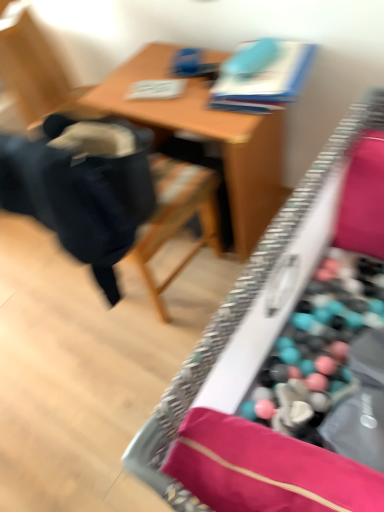
Question: Considering the relative positions of wooden desk at center and black fabric chair at left in the image provided, is wooden desk at center to the left of black fabric chair at left from the viewer's perspective?

Choices:
 (A) no
 (B) yes

Answer: (A)

Question: Would you say wooden desk at center is a long distance from black fabric chair at left?

Choices:
 (A) yes
 (B) no

Answer: (B)

Question: From a real-world perspective, does wooden desk at center stand above black fabric chair at left?

Choices:
 (A) no
 (B) yes

Answer: (A)

Question: From a real-world perspective, is wooden desk at center beneath black fabric chair at left?

Choices:
 (A) no
 (B) yes

Answer: (B)

Question: From the image's perspective, is wooden desk at center over black fabric chair at left?

Choices:
 (A) no
 (B) yes

Answer: (A)

Question: Considering the positions of black fabric chair at left and wooden table at center in the image, is black fabric chair at left taller or shorter than wooden table at center?

Choices:
 (A) tall
 (B) short

Answer: (A)

Question: Considering the positions of black fabric chair at left and wooden table at center in the image, is black fabric chair at left wider or thinner than wooden table at center?

Choices:
 (A) wide
 (B) thin

Answer: (A)

Question: In terms of size, does black fabric chair at left appear bigger or smaller than wooden table at center?

Choices:
 (A) big
 (B) small

Answer: (A)

Question: From a real-world perspective, is black fabric chair at left physically located above or below wooden table at center?

Choices:
 (A) above
 (B) below

Answer: (A)

Question: In terms of width, does wooden table at center look wider or thinner when compared to black fabric chair at left?

Choices:
 (A) thin
 (B) wide

Answer: (A)

Question: In terms of height, does wooden table at center look taller or shorter compared to black fabric chair at left?

Choices:
 (A) tall
 (B) short

Answer: (B)

Question: From the image's perspective, is wooden table at center above or below black fabric chair at left?

Choices:
 (A) above
 (B) below

Answer: (A)

Question: From a real-world perspective, is wooden table at center above or below black fabric chair at left?

Choices:
 (A) below
 (B) above

Answer: (A)

Question: Is wooden table at center wider or thinner than wooden desk at center?

Choices:
 (A) thin
 (B) wide

Answer: (A)

Question: Considering the relative positions of wooden table at center and wooden desk at center in the image provided, is wooden table at center to the left or to the right of wooden desk at center?

Choices:
 (A) right
 (B) left

Answer: (B)